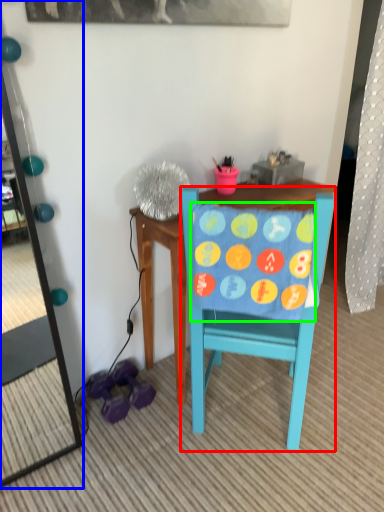
Question: Estimate the real-world distances between objects in this image. Which object is farther from chair (highlighted by a red box), mirror (highlighted by a blue box) or blanket (highlighted by a green box)?

Choices:
 (A) mirror
 (B) blanket

Answer: (A)